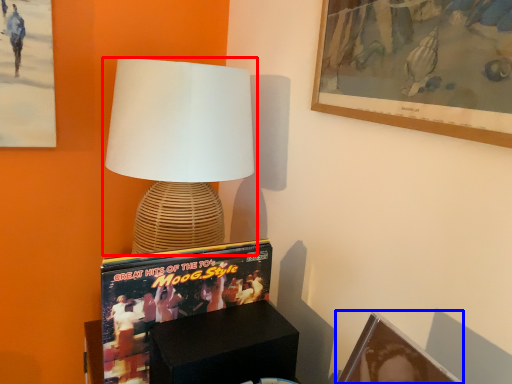
Question: Which object is further to the camera taking this photo, lamp (highlighted by a red box) or picture frame (highlighted by a blue box)?

Choices:
 (A) lamp
 (B) picture frame

Answer: (A)